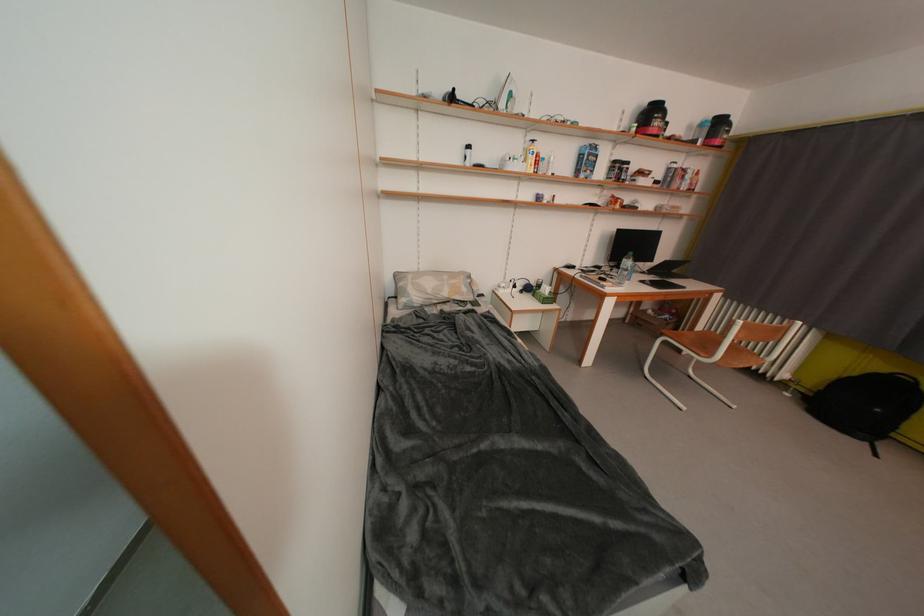
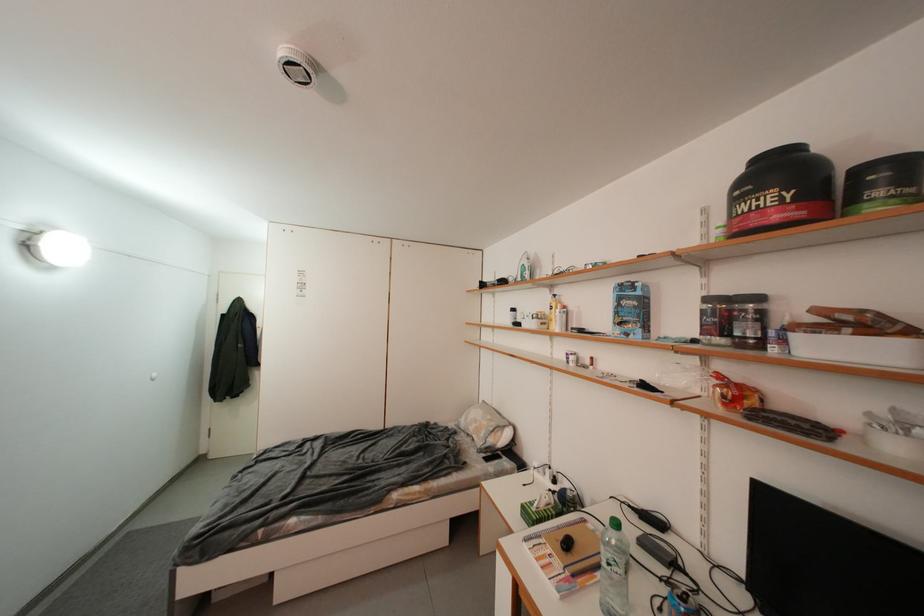
In the second image, find the point that corresponds to the point at 636,167 in the first image.

(766, 301)